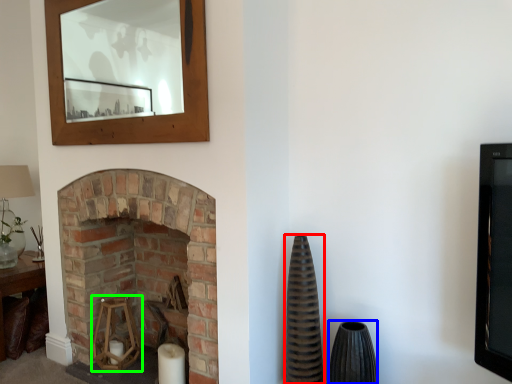
Question: Based on their relative distances, which object is nearer to vase (highlighted by a red box)? Choose from vase (highlighted by a blue box) and candle holder (highlighted by a green box).

Choices:
 (A) vase
 (B) candle holder

Answer: (A)